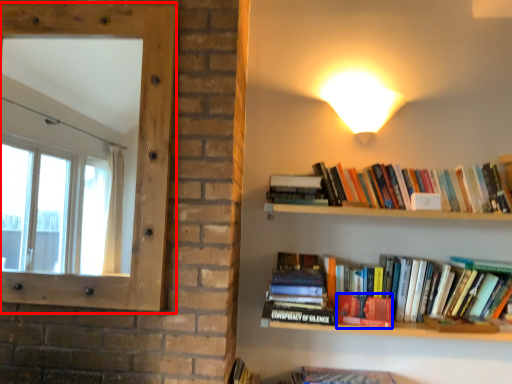
Question: Among these objects, which one is farthest to the camera, window screen (highlighted by a red box) or paperback book (highlighted by a blue box)?

Choices:
 (A) window screen
 (B) paperback book

Answer: (B)